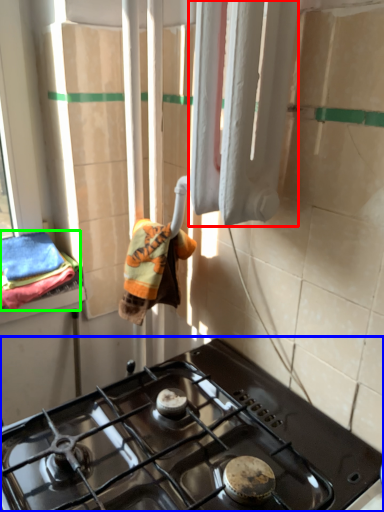
Question: Which is farther away from curtain (highlighted by a red box)? gas stove (highlighted by a blue box) or bath towel (highlighted by a green box)?

Choices:
 (A) gas stove
 (B) bath towel

Answer: (B)